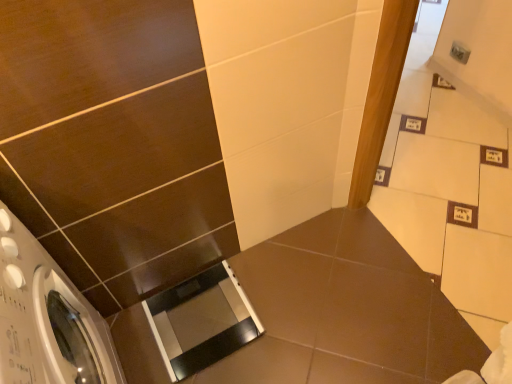
Locate an element on the screen. vacant region below transparent plastic screen door at lower center (from a real-world perspective) is located at coordinates (198, 319).